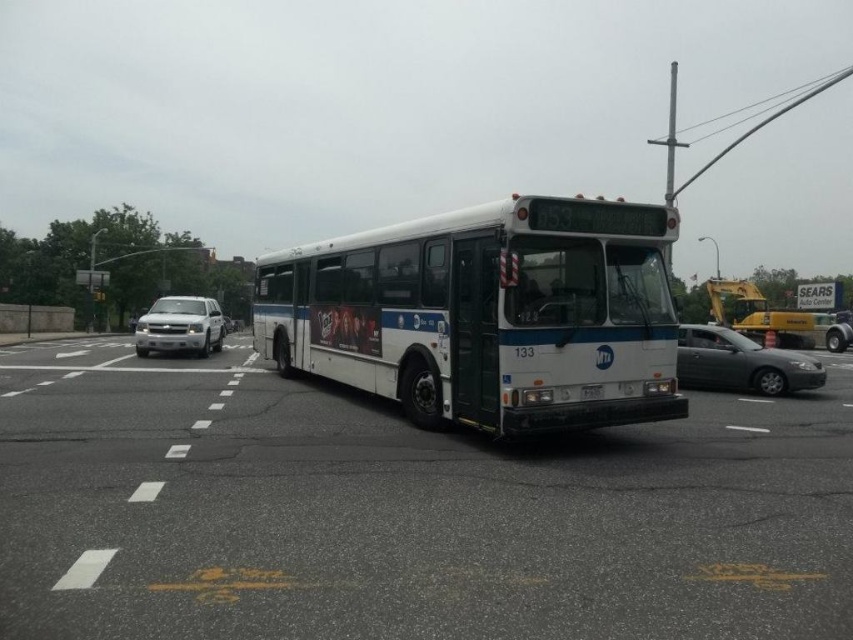
Who is positioned more to the left, satin silver sedan at right or silver metallic truck at left?

Positioned to the left is silver metallic truck at left.

Between satin silver sedan at right and silver metallic truck at left, which one is positioned higher?

silver metallic truck at left

I want to click on satin silver sedan at right, so [741, 362].

Is white metallic bus at center below satin silver sedan at right?

Actually, white metallic bus at center is above satin silver sedan at right.

Identify the location of white metallic bus at center. The width and height of the screenshot is (853, 640). (486, 314).

The width and height of the screenshot is (853, 640). Describe the element at coordinates (486, 314) in the screenshot. I see `white metallic bus at center` at that location.

You are a GUI agent. You are given a task and a screenshot of the screen. Output one action in this format:
    pyautogui.click(x=<x>, y=<y>)
    Task: Click on the white metallic bus at center
    
    Given the screenshot: What is the action you would take?
    pyautogui.click(x=486, y=314)

Can you confirm if white metallic bus at center is positioned to the right of white plastic license plate at center?

No, white metallic bus at center is not to the right of white plastic license plate at center.

Is point (331, 266) positioned behind point (601, 387)?

That is True.

Is point (560, 428) more distant than point (581, 397)?

No, (560, 428) is closer to viewer.

This screenshot has height=640, width=853. I want to click on white metallic bus at center, so click(486, 314).